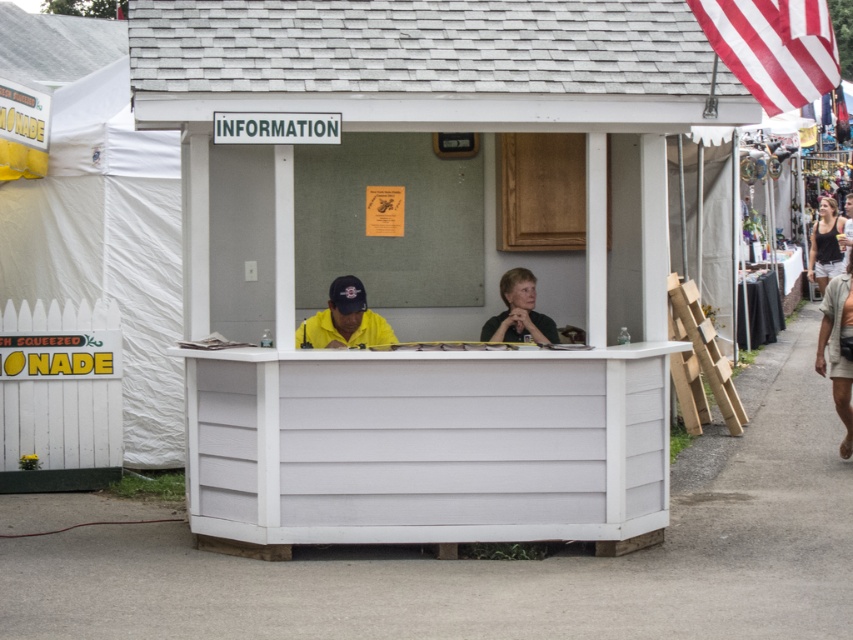
Where is `white wood information booth at center`? The image size is (853, 640). white wood information booth at center is located at coordinates (416, 307).

How much distance is there between white wood information booth at center and matte black tank top at right?

white wood information booth at center and matte black tank top at right are 54.69 feet apart.

In order to click on white wood information booth at center in this screenshot , I will do `click(416, 307)`.

Does black matte shirt at center have a lesser width compared to matte black tank top at right?

Indeed, black matte shirt at center has a lesser width compared to matte black tank top at right.

Is point (543, 337) positioned before point (830, 266)?

Yes.

Locate an element on the screen. The width and height of the screenshot is (853, 640). black matte shirt at center is located at coordinates (518, 310).

I want to click on black matte shirt at center, so click(x=518, y=310).

Can you confirm if white wood information booth at center is taller than yellow matte shirt at center?

Indeed, white wood information booth at center has a greater height compared to yellow matte shirt at center.

This screenshot has height=640, width=853. Describe the element at coordinates (416, 307) in the screenshot. I see `white wood information booth at center` at that location.

Where is `white wood information booth at center`? This screenshot has height=640, width=853. white wood information booth at center is located at coordinates (416, 307).